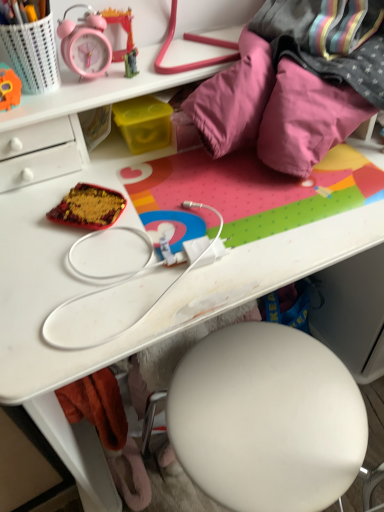
Question: Is matte plastic alarm clock at upper left, placed as the second stationery when sorted from right to left, to the left of shiny red fabric at center from the viewer's perspective?

Choices:
 (A) yes
 (B) no

Answer: (A)

Question: Is matte plastic alarm clock at upper left, the 2th stationery from the left, shorter than shiny red fabric at center?

Choices:
 (A) yes
 (B) no

Answer: (B)

Question: Is matte plastic alarm clock at upper left, the 2th stationery from the left, facing towards shiny red fabric at center?

Choices:
 (A) no
 (B) yes

Answer: (A)

Question: From a real-world perspective, is matte plastic alarm clock at upper left, placed as the second stationery when sorted from right to left, physically above shiny red fabric at center?

Choices:
 (A) yes
 (B) no

Answer: (A)

Question: From the image's perspective, does matte plastic alarm clock at upper left, placed as the second stationery when sorted from right to left, appear lower than shiny red fabric at center?

Choices:
 (A) yes
 (B) no

Answer: (B)

Question: Does matte plastic alarm clock at upper left, the 2th stationery from the left, lie behind shiny red fabric at center?

Choices:
 (A) yes
 (B) no

Answer: (A)

Question: Considering the relative positions of shiny red fabric at center and matte plastic pencil case at upper left, the third stationery from the right, in the image provided, is shiny red fabric at center to the left of matte plastic pencil case at upper left, the third stationery from the right, from the viewer's perspective?

Choices:
 (A) yes
 (B) no

Answer: (B)

Question: Is shiny red fabric at center surrounding matte plastic pencil case at upper left, the third stationery from the right?

Choices:
 (A) no
 (B) yes

Answer: (A)

Question: From the image's perspective, is shiny red fabric at center above matte plastic pencil case at upper left, the 1th stationery in the left-to-right sequence?

Choices:
 (A) yes
 (B) no

Answer: (B)

Question: From a real-world perspective, is shiny red fabric at center located higher than matte plastic pencil case at upper left, the third stationery from the right?

Choices:
 (A) no
 (B) yes

Answer: (A)

Question: Does shiny red fabric at center have a lesser width compared to matte plastic pencil case at upper left, the third stationery from the right?

Choices:
 (A) no
 (B) yes

Answer: (A)

Question: Considering the relative sizes of shiny red fabric at center and matte plastic pencil case at upper left, the 1th stationery in the left-to-right sequence, in the image provided, is shiny red fabric at center wider than matte plastic pencil case at upper left, the 1th stationery in the left-to-right sequence,?

Choices:
 (A) no
 (B) yes

Answer: (B)

Question: Are matte plastic alarm clock at upper left, the 2th stationery from the left, and orange plush toy at upper left beside each other?

Choices:
 (A) yes
 (B) no

Answer: (B)